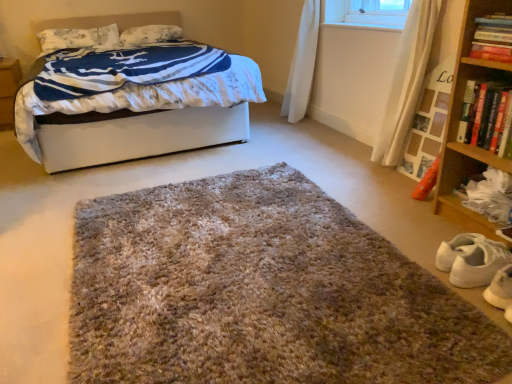
What is the approximate height of white soft bed at upper left?

The height of white soft bed at upper left is 34.04 inches.

Image resolution: width=512 pixels, height=384 pixels. What do you see at coordinates (8, 90) in the screenshot?
I see `brown cardboard at left` at bounding box center [8, 90].

What is the approximate height of wooden shelf at lower right?

It is 8.40 inches.

Where is `shaggy carpet at center`? shaggy carpet at center is located at coordinates (261, 293).

The width and height of the screenshot is (512, 384). What are the coordinates of `white textured pillow at upper left, positioned as the second pillow in left-to-right order` in the screenshot? It's located at (150, 35).

Describe the element at coordinates (484, 114) in the screenshot. I see `hardcover book at right, the 2th book positioned from the top` at that location.

Locate an element on the screen. white soft bed at upper left is located at coordinates (138, 118).

Based on the photo, from a real-world perspective, is wooden shelf at lower right physically below hardcover book at upper right, the 1th book viewed from the top?

Yes.

Measure the distance from wooden shelf at lower right to hardcover book at upper right, the 1th book viewed from the top.

20.05 inches.

Is wooden shelf at lower right positioned beyond the bounds of hardcover book at upper right, the 1th book viewed from the top?

wooden shelf at lower right is positioned outside hardcover book at upper right, the 1th book viewed from the top.

From the image's perspective, is wooden shelf at lower right located beneath hardcover book at upper right, the second book ordered from the bottom?

Yes.

Could you tell me if white floral fabric pillow at upper left, positioned as the first pillow in left-to-right order, is turned towards brown cardboard at left?

No, white floral fabric pillow at upper left, positioned as the first pillow in left-to-right order, is not turned towards brown cardboard at left.

Looking at the image, does white floral fabric pillow at upper left, positioned as the first pillow in left-to-right order, seem bigger or smaller compared to brown cardboard at left?

Considering their sizes, white floral fabric pillow at upper left, positioned as the first pillow in left-to-right order, takes up less space than brown cardboard at left.

Choose the correct answer: Is white floral fabric pillow at upper left, the 2th pillow viewed from the right, inside brown cardboard at left or outside it?

white floral fabric pillow at upper left, the 2th pillow viewed from the right, is spatially situated outside brown cardboard at left.

Which point is more distant from viewer, (52, 36) or (0, 75)?

The point (52, 36) is farther from the camera.

Is point (158, 90) closer or farther from the camera than point (136, 44)?

Point (158, 90) is closer to the camera than point (136, 44).

Is white soft bed at upper left positioned with its back to white textured pillow at upper left, positioned as the second pillow in left-to-right order?

Correct, white soft bed at upper left is looking away from white textured pillow at upper left, positioned as the second pillow in left-to-right order.

Can you confirm if white soft bed at upper left is wider than white textured pillow at upper left, positioned as the second pillow in left-to-right order?

Indeed, white soft bed at upper left has a greater width compared to white textured pillow at upper left, positioned as the second pillow in left-to-right order.

Can you tell me how much white soft bed at upper left and white textured pillow at upper left, which ranks as the 1th pillow in right-to-left order, differ in facing direction?

2.42 degrees.

Where is `the 1st pillow counting from the left of the hardcover book at upper right, the 1th book viewed from the top`? the 1st pillow counting from the left of the hardcover book at upper right, the 1th book viewed from the top is located at coordinates (150, 35).

From the image's perspective, is white textured pillow at upper left, positioned as the second pillow in left-to-right order, located above or below hardcover book at upper right, the second book ordered from the bottom?

white textured pillow at upper left, positioned as the second pillow in left-to-right order, is situated higher than hardcover book at upper right, the second book ordered from the bottom, in the image.

In terms of height, does white textured pillow at upper left, positioned as the second pillow in left-to-right order, look taller or shorter compared to hardcover book at upper right, the second book ordered from the bottom?

Considering their sizes, white textured pillow at upper left, positioned as the second pillow in left-to-right order, has more height than hardcover book at upper right, the second book ordered from the bottom.

Is white textured pillow at upper left, positioned as the second pillow in left-to-right order, facing away from hardcover book at upper right, the 1th book viewed from the top?

No.

Considering the sizes of objects hardcover book at upper right, the second book ordered from the bottom, and white soft bed at upper left in the image provided, who is shorter, hardcover book at upper right, the second book ordered from the bottom, or white soft bed at upper left?

Standing shorter between the two is hardcover book at upper right, the second book ordered from the bottom.

Choose the correct answer: Is hardcover book at upper right, the second book ordered from the bottom, inside white soft bed at upper left or outside it?

hardcover book at upper right, the second book ordered from the bottom, cannot be found inside white soft bed at upper left.

Which is closer, (479, 48) or (157, 121)?

Point (479, 48) is positioned closer to the camera compared to point (157, 121).

From a real-world perspective, is wooden bookshelf at right physically below white soft bed at upper left?

No, from a real-world perspective, wooden bookshelf at right is not below white soft bed at upper left.

Is the surface of wooden bookshelf at right in direct contact with white soft bed at upper left?

No, wooden bookshelf at right is not making contact with white soft bed at upper left.

Looking at this image, how different are the orientations of wooden bookshelf at right and white soft bed at upper left in degrees?

The angular difference between wooden bookshelf at right and white soft bed at upper left is 88.9 degrees.

Is hardcover book at upper right, the 1th book viewed from the top, thinner than hardcover book at right, which is the 1th book in bottom-to-top order?

Yes, hardcover book at upper right, the 1th book viewed from the top, is thinner than hardcover book at right, which is the 1th book in bottom-to-top order.

Is hardcover book at right, the 2th book positioned from the top, at the back of hardcover book at upper right, the 1th book viewed from the top?

No, hardcover book at upper right, the 1th book viewed from the top,'s orientation is not away from hardcover book at right, the 2th book positioned from the top.

From the image's perspective, which one is positioned higher, hardcover book at upper right, the second book ordered from the bottom, or hardcover book at right, which is the 1th book in bottom-to-top order?

hardcover book at upper right, the second book ordered from the bottom, is shown above in the image.

Can you tell me how much hardcover book at upper right, the second book ordered from the bottom, and hardcover book at right, the 2th book positioned from the top, differ in facing direction?

hardcover book at upper right, the second book ordered from the bottom, and hardcover book at right, the 2th book positioned from the top, are facing 2.15 degrees away from each other.

You are a GUI agent. You are given a task and a screenshot of the screen. Output one action in this format:
    pyautogui.click(x=<x>, y=<y>)
    Task: Click on the book that is on the left side of wooden shelf at lower right
    
    Given the screenshot: What is the action you would take?
    pyautogui.click(x=493, y=38)

The height and width of the screenshot is (384, 512). Find the location of `the 1st pillow positioned above the brown cardboard at left (from the image's perspective)`. the 1st pillow positioned above the brown cardboard at left (from the image's perspective) is located at coordinates (79, 38).

Considering their positions, is hardcover book at upper right, the 1th book viewed from the top, positioned closer to wooden shelf at lower right than white textured pillow at upper left, positioned as the second pillow in left-to-right order?

hardcover book at upper right, the 1th book viewed from the top, is positioned closer to the anchor wooden shelf at lower right.

Based on their spatial positions, is white soft bed at upper left or white textured pillow at upper left, which ranks as the 1th pillow in right-to-left order, further from wooden shelf at lower right?

Based on the image, white textured pillow at upper left, which ranks as the 1th pillow in right-to-left order, appears to be further to wooden shelf at lower right.

Estimate the real-world distances between objects in this image. Which object is further from wooden bookshelf at right, white textured pillow at upper left, positioned as the second pillow in left-to-right order, or wooden shelf at lower right?

white textured pillow at upper left, positioned as the second pillow in left-to-right order, lies further to wooden bookshelf at right than the other object.

Estimate the real-world distances between objects in this image. Which object is closer to brown cardboard at left, white soft bed at upper left or white floral fabric pillow at upper left, the 2th pillow viewed from the right?

white floral fabric pillow at upper left, the 2th pillow viewed from the right.

From the image, which object appears to be nearer to wooden bookshelf at right, white textured pillow at upper left, positioned as the second pillow in left-to-right order, or white floral fabric pillow at upper left, positioned as the first pillow in left-to-right order?

white textured pillow at upper left, positioned as the second pillow in left-to-right order.

Which object lies nearer to the anchor point hardcover book at upper right, the second book ordered from the bottom, white soft bed at upper left or white textured pillow at upper left, which ranks as the 1th pillow in right-to-left order?

white soft bed at upper left.

Considering their positions, is white textured pillow at upper left, positioned as the second pillow in left-to-right order, positioned closer to white soft bed at upper left than wooden shelf at lower right?

Among the two, wooden shelf at lower right is located nearer to white soft bed at upper left.

Based on their spatial positions, is white soft bed at upper left or white textured pillow at upper left, positioned as the second pillow in left-to-right order, further from brown cardboard at left?

Based on the image, white soft bed at upper left appears to be further to brown cardboard at left.

You are a GUI agent. You are given a task and a screenshot of the screen. Output one action in this format:
    pyautogui.click(x=<x>, y=<y>)
    Task: Click on the bed between white floral fabric pillow at upper left, the 2th pillow viewed from the right, and hardcover book at right, which is the 1th book in bottom-to-top order, from left to right
    The height and width of the screenshot is (384, 512).
    Given the screenshot: What is the action you would take?
    pyautogui.click(x=138, y=118)

You are a GUI agent. You are given a task and a screenshot of the screen. Output one action in this format:
    pyautogui.click(x=<x>, y=<y>)
    Task: Click on the shelf located between shaggy carpet at center and hardcover book at right, the 2th book positioned from the top, in the left-right direction
    The height and width of the screenshot is (384, 512).
    Given the screenshot: What is the action you would take?
    pyautogui.click(x=462, y=182)

Identify the location of book between brown cardboard at left and wooden shelf at lower right from left to right. This screenshot has height=384, width=512. (493, 38).

The width and height of the screenshot is (512, 384). What are the coordinates of `book between white floral fabric pillow at upper left, positioned as the first pillow in left-to-right order, and wooden shelf at lower right from left to right` in the screenshot? It's located at (493, 38).